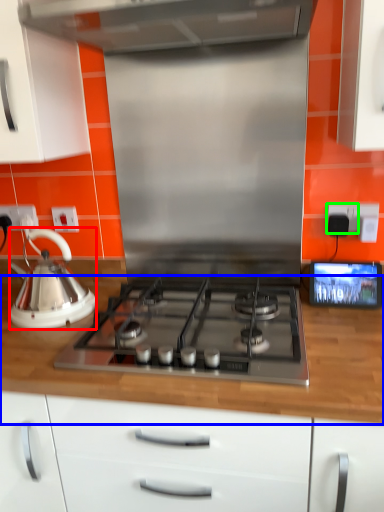
Question: Based on their relative distances, which object is farther from kettle (highlighted by a red box)? Choose from countertop (highlighted by a blue box) and electric outlet (highlighted by a green box).

Choices:
 (A) countertop
 (B) electric outlet

Answer: (B)